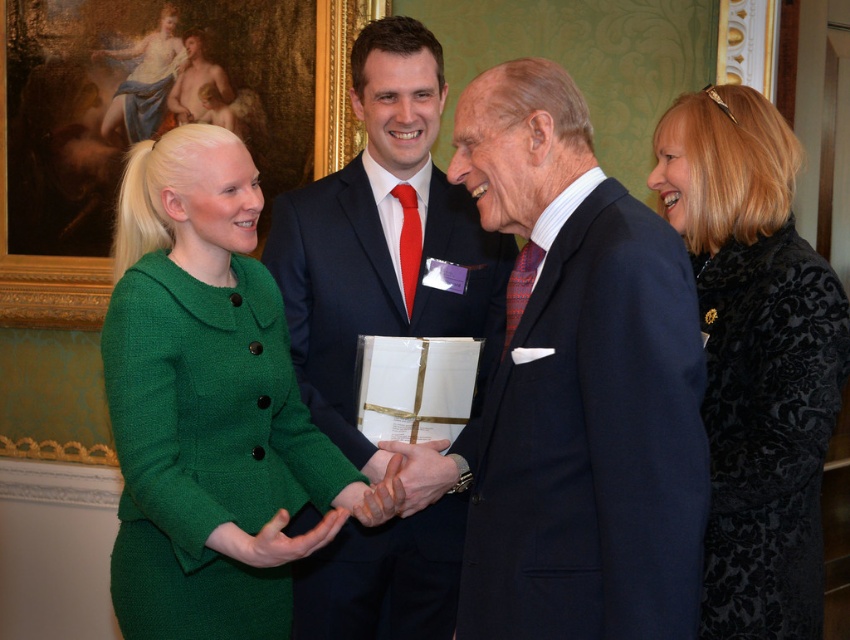
Question: Is the position of green woolen dress at center less distant than that of navy wool suit at center?

Choices:
 (A) yes
 (B) no

Answer: (B)

Question: Observing the image, what is the correct spatial positioning of black velvet coat at right in reference to dark blue wool suit at center?

Choices:
 (A) left
 (B) right

Answer: (B)

Question: Which of the following is the farthest from the observer?

Choices:
 (A) (607, 573)
 (B) (727, 564)

Answer: (B)

Question: Which point appears closest to the camera in this image?

Choices:
 (A) (341, 273)
 (B) (129, 448)

Answer: (B)

Question: Observing the image, what is the correct spatial positioning of green woolen dress at center in reference to dark blue wool suit at center?

Choices:
 (A) left
 (B) right

Answer: (A)

Question: Based on their relative distances, which object is nearer to the navy wool suit at center?

Choices:
 (A) green woolen dress at center
 (B) black velvet coat at right

Answer: (B)